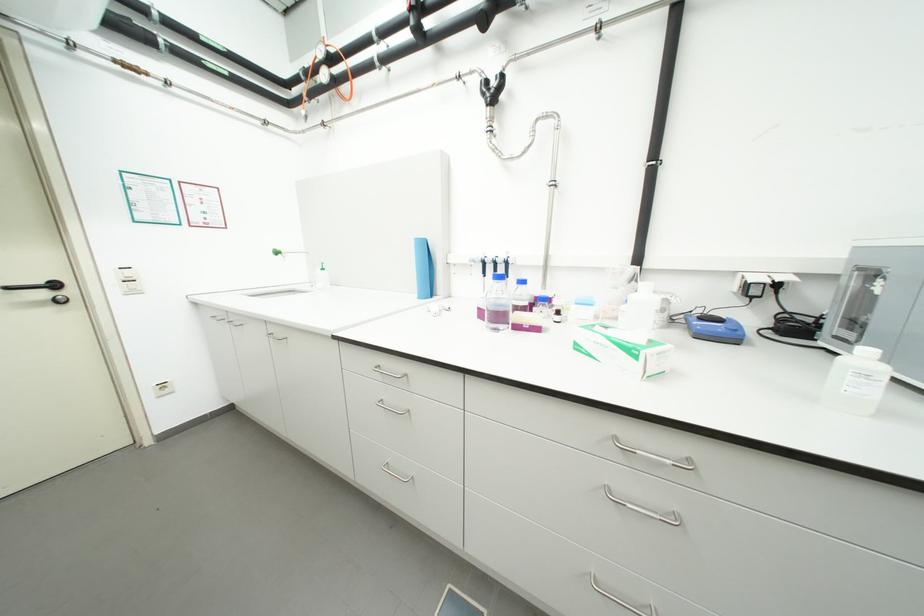
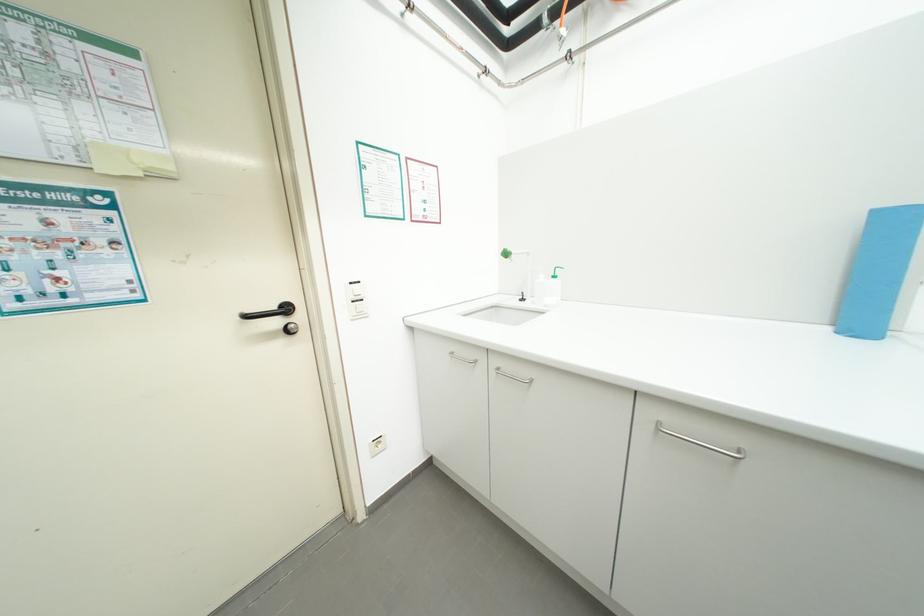
The images are taken continuously from a first-person perspective. In which direction are you moving?

The movement direction of the cameraman is left, forward.